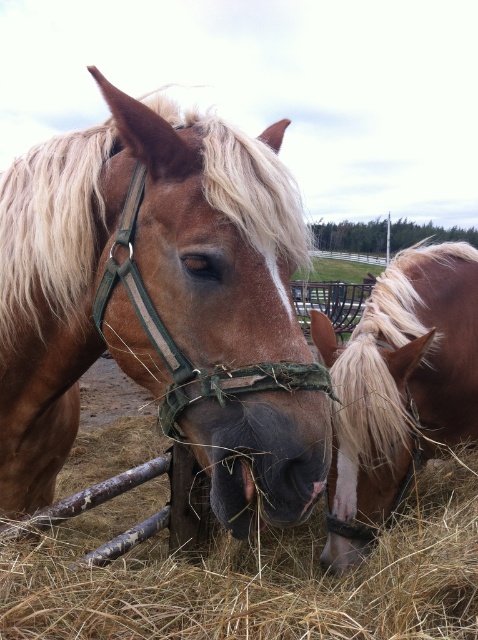
You are a farmer checking the pasture. You notice the brown matte horse at center and the brown dry hay at center. Which object is taller?

The brown matte horse at center is taller than the brown dry hay at center.

You are a farmer checking the feeding area. You see the brown dry hay at center and the blonde mane horse at right. Which object takes up more space in the image?

The brown dry hay at center takes up more space in the image because it is larger in size than the blonde mane horse at right.